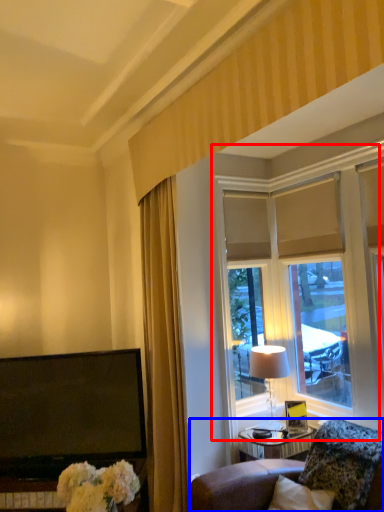
Question: Which object is closer to the camera taking this photo, window (highlighted by a red box) or furniture (highlighted by a blue box)?

Choices:
 (A) window
 (B) furniture

Answer: (B)